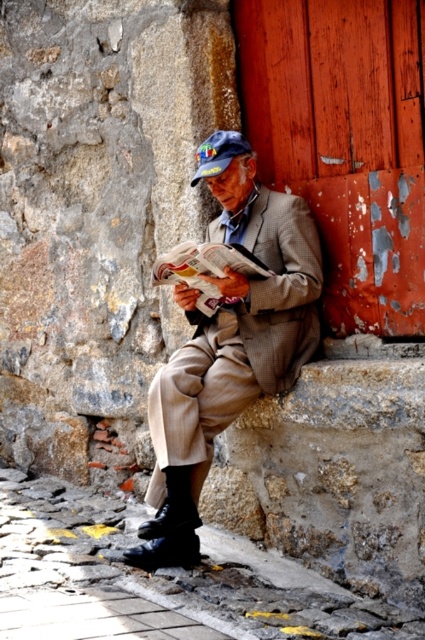
Question: Does peeling paint door at right have a smaller size compared to checkered wool suit at center?

Choices:
 (A) no
 (B) yes

Answer: (A)

Question: Where is peeling paint door at right located in relation to checkered wool suit at center in the image?

Choices:
 (A) above
 (B) below

Answer: (A)

Question: Is peeling paint door at right behind checkered wool suit at center?

Choices:
 (A) yes
 (B) no

Answer: (B)